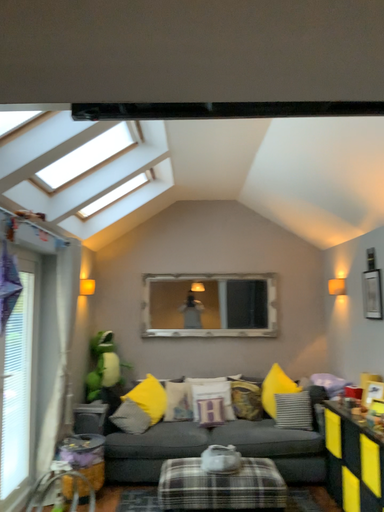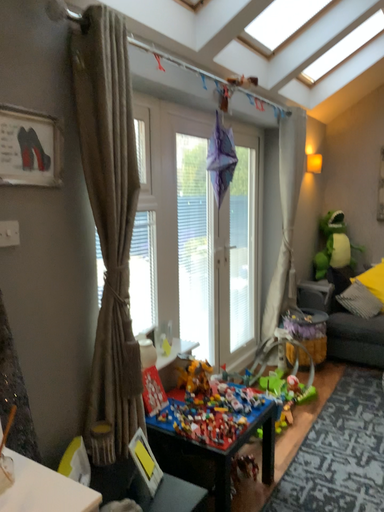
Question: Which way did the camera rotate in the video?

Choices:
 (A) rotated downward
 (B) rotated upward

Answer: (A)